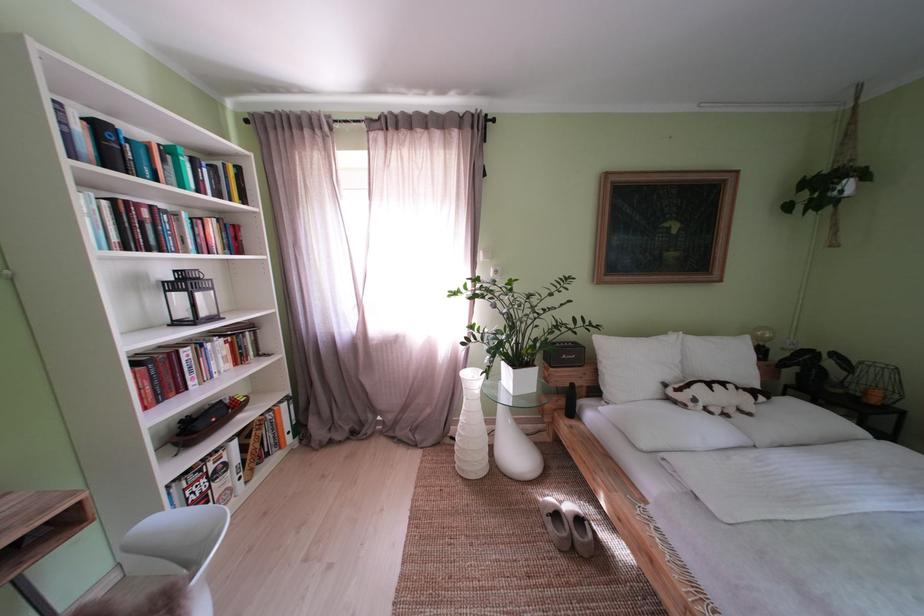
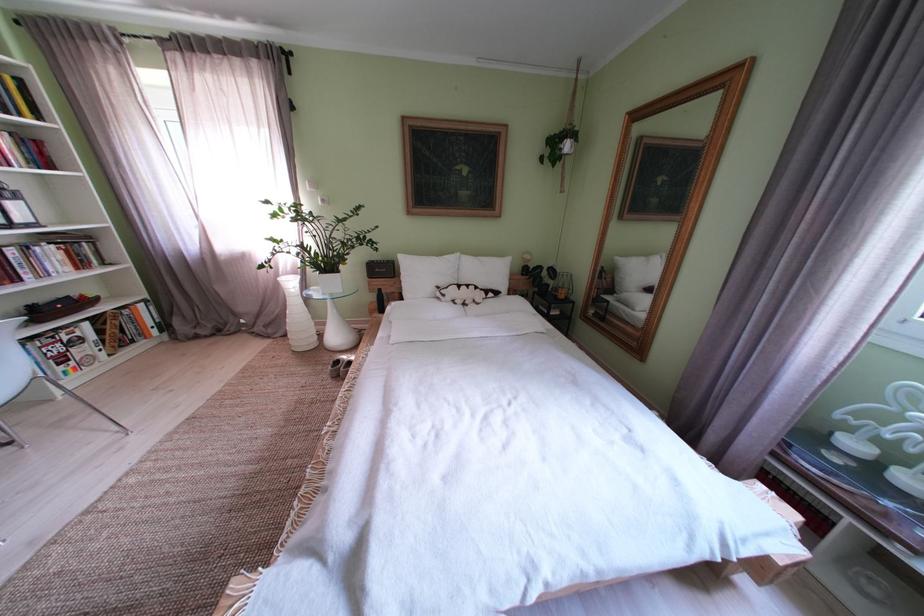
The point at (706,406) is marked in the first image. Where is the corresponding point in the second image?

(455, 301)